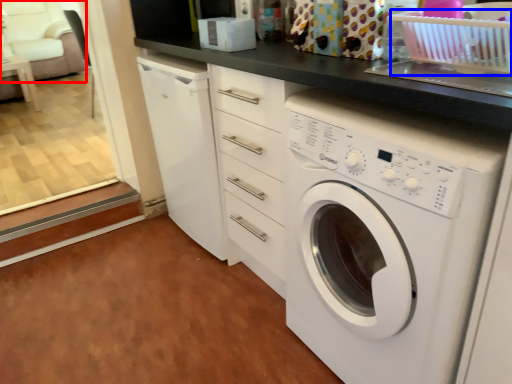
Question: Which point is further to the camera, armchair (highlighted by a red box) or basket (highlighted by a blue box)?

Choices:
 (A) armchair
 (B) basket

Answer: (A)